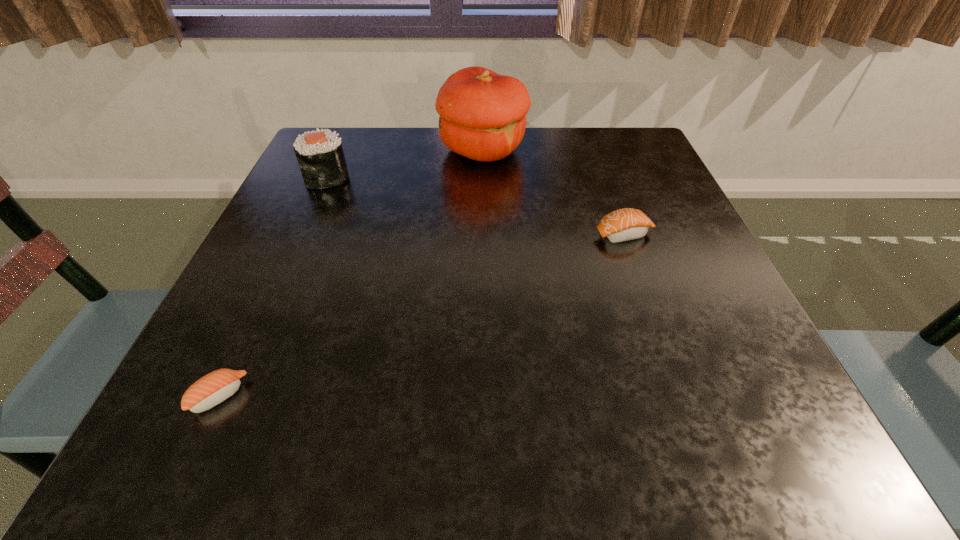
Find the location of a particular element. The width and height of the screenshot is (960, 540). free space located 0.120m on the right of the nearest object is located at coordinates (330, 396).

Locate an element on the screen. The height and width of the screenshot is (540, 960). pumpkin that is at the far edge is located at coordinates (482, 114).

Identify the location of sushi that is at the far edge. The width and height of the screenshot is (960, 540). (320, 156).

This screenshot has height=540, width=960. I want to click on object at the near edge, so click(x=212, y=389).

Where is `object positioned at the right edge`? This screenshot has height=540, width=960. object positioned at the right edge is located at coordinates [625, 224].

What are the coordinates of `object situated at the far left corner` in the screenshot? It's located at (320, 156).

Where is `object present at the near left corner`? The image size is (960, 540). object present at the near left corner is located at coordinates (212, 389).

This screenshot has width=960, height=540. In the image, there is a desktop. In order to click on blank space at the far edge in this screenshot , I will do `click(571, 130)`.

The image size is (960, 540). I want to click on vacant area at the near edge of the desktop, so click(678, 437).

The height and width of the screenshot is (540, 960). I want to click on blank area at the left edge, so click(326, 204).